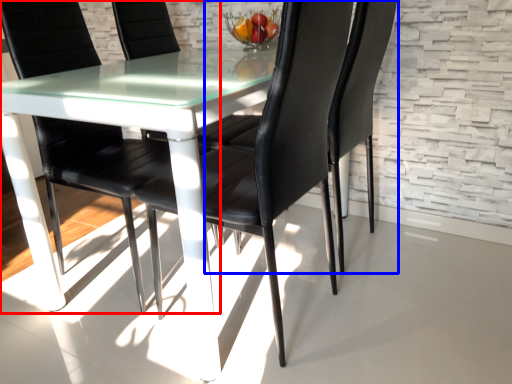
Question: Which of the following is the closest to the observer, chair (highlighted by a red box) or chair (highlighted by a blue box)?

Choices:
 (A) chair
 (B) chair

Answer: (A)